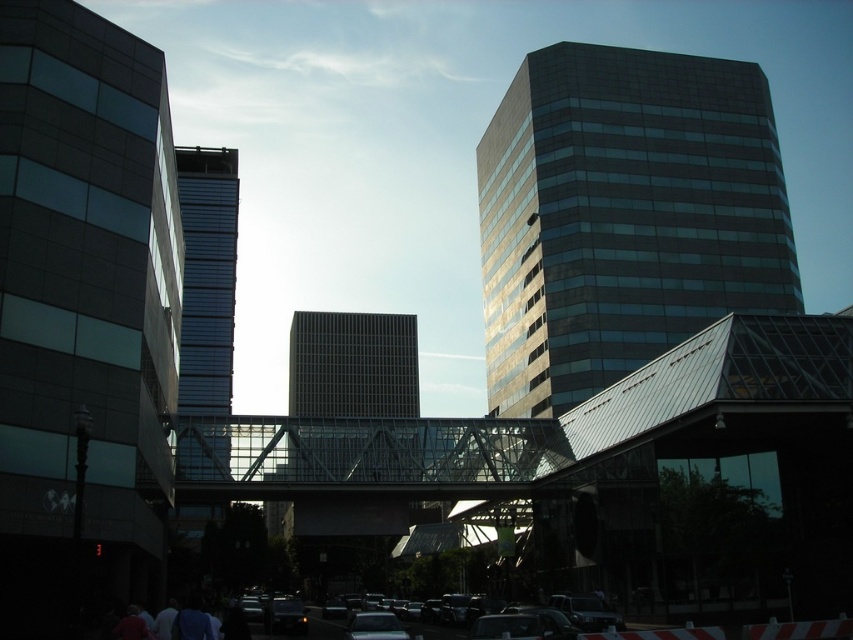
Question: Can you confirm if shiny glass building at center is positioned below shiny black car at center?

Choices:
 (A) yes
 (B) no

Answer: (B)

Question: Which of the following is the closest to the observer?

Choices:
 (A) transparent glass bridge at center
 (B) glassy blue skyscraper at center
 (C) glassy reflective building at left

Answer: (C)

Question: Is glassy reflective building at left further to camera compared to matte glass tower at center?

Choices:
 (A) yes
 (B) no

Answer: (B)

Question: Which object appears farthest from the camera in this image?

Choices:
 (A) matte glass tower at center
 (B) shiny black car at center
 (C) glassy reflective building at left
 (D) shiny glass building at center

Answer: (D)

Question: Is matte glass tower at center positioned at the back of shiny black car at lower center?

Choices:
 (A) no
 (B) yes

Answer: (B)

Question: Which object is farther from the camera taking this photo?

Choices:
 (A) shiny black car at center
 (B) shiny glass building at center

Answer: (B)